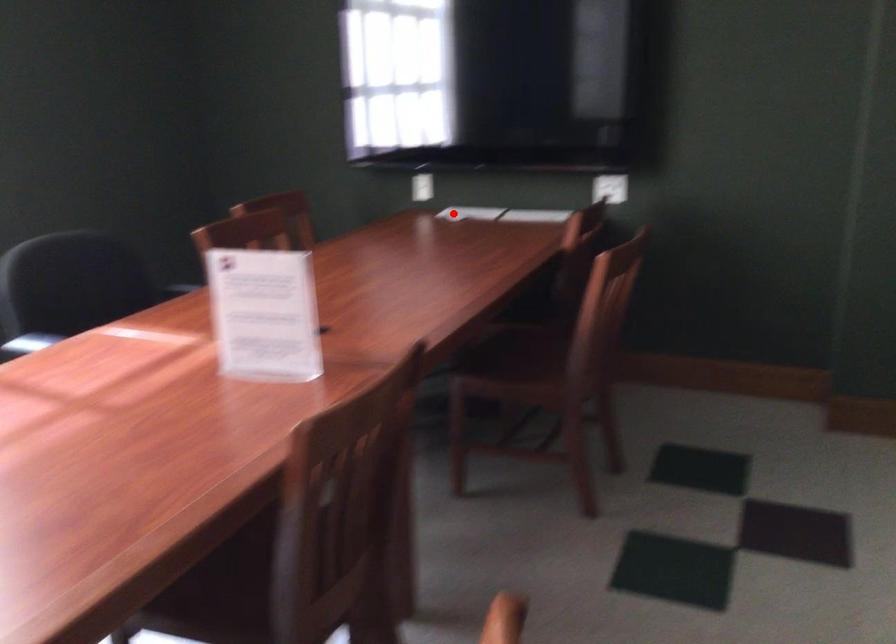
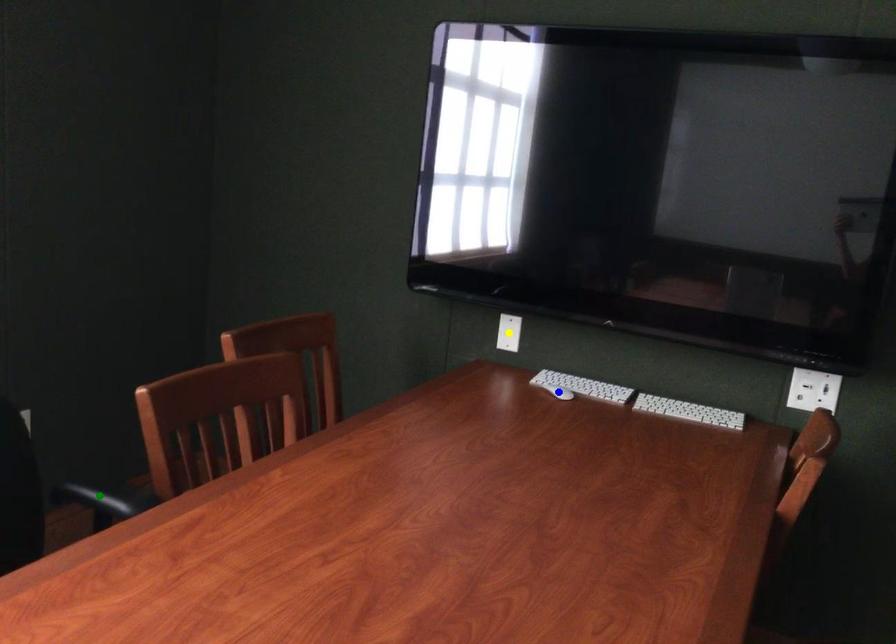
Question: I am providing you with two images of the same scene from different viewpoints. A red point is marked on the first image. You are given multiple points on the second image. In image 2, which mark is for the same physical point as the one in image 1?

Choices:
 (A) green point
 (B) blue point
 (C) yellow point

Answer: (B)